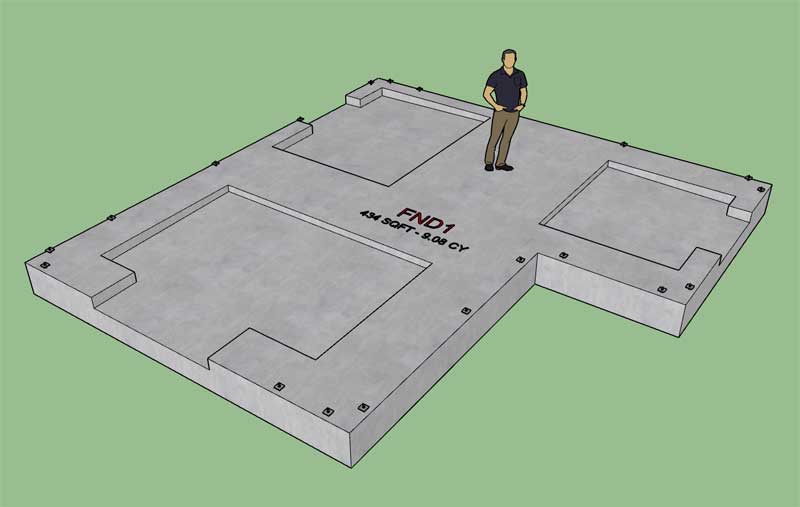
What are the coordinates of `stage floor` in the screenshot? It's located at (476, 195).